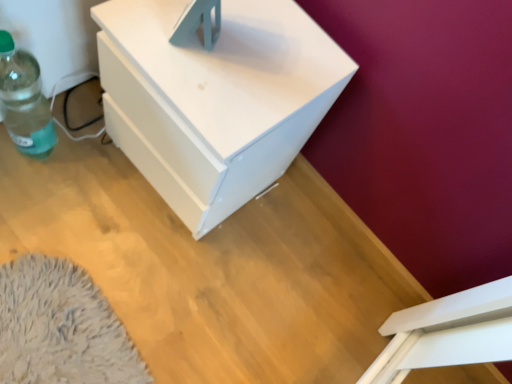
You are a GUI agent. You are given a task and a screenshot of the screen. Output one action in this format:
    pyautogui.click(x=<x>, y=<y>)
    Task: Click on the free space in front of white matte nightstand at center
    The image size is (512, 384).
    Given the screenshot: What is the action you would take?
    pyautogui.click(x=127, y=264)